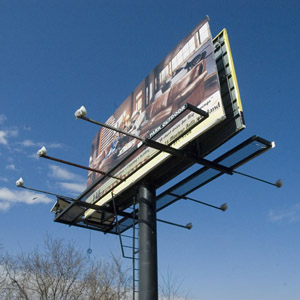
This screenshot has height=300, width=300. I want to click on leather, so click(178, 90).